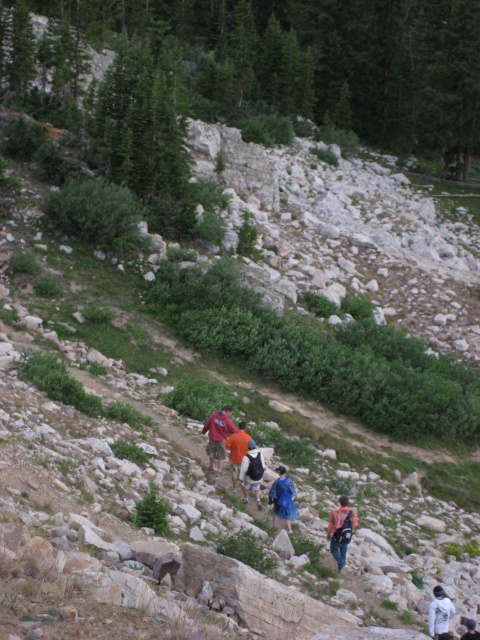
Question: Is matte red shirt at center below blue fabric backpack at center?

Choices:
 (A) yes
 (B) no

Answer: (B)

Question: Which point is closer to the camera?

Choices:
 (A) (332, 524)
 (B) (464, 621)

Answer: (B)

Question: Is denim jacket at lower center thinner than orange fabric shirt at center?

Choices:
 (A) yes
 (B) no

Answer: (A)

Question: Which point is closer to the camera taking this photo?

Choices:
 (A) (337, 557)
 (B) (228, 410)

Answer: (A)

Question: Considering the real-world distances, which object is closest to the white fabric jacket at lower right?

Choices:
 (A) blue fabric backpack at center
 (B) matte red shirt at center
 (C) orange fabric backpack at center
 (D) orange fabric shirt at center

Answer: (A)

Question: Is matte red shirt at center to the left of orange fabric backpack at center from the viewer's perspective?

Choices:
 (A) no
 (B) yes

Answer: (B)